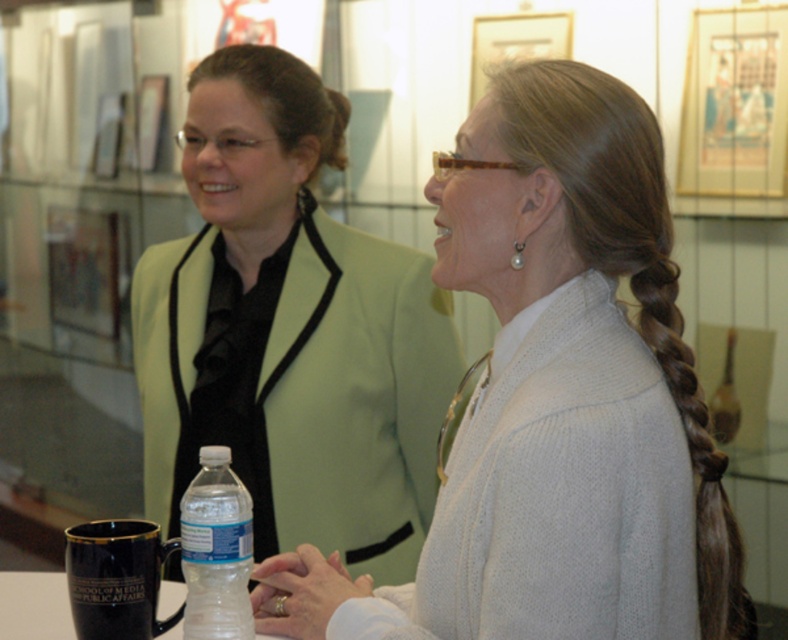
Question: Which of the following is the farthest from the observer?

Choices:
 (A) black ceramic mug at lower left
 (B) transparent plastic bottle at lower center
 (C) matte green blazer at upper left
 (D) clear plastic bottle at lower center

Answer: (C)

Question: Does white knitted sweater at center come in front of matte green blazer at upper left?

Choices:
 (A) yes
 (B) no

Answer: (A)

Question: Can you confirm if black ceramic mug at lower left is smaller than transparent plastic bottle at lower center?

Choices:
 (A) yes
 (B) no

Answer: (A)

Question: Can you confirm if matte green blazer at upper left is thinner than transparent plastic bottle at lower center?

Choices:
 (A) no
 (B) yes

Answer: (A)

Question: Which object is positioned closest to the white knitted sweater at center?

Choices:
 (A) clear plastic bottle at lower center
 (B) black ceramic mug at lower left
 (C) matte green blazer at upper left

Answer: (A)

Question: Which of the following is the closest to the observer?

Choices:
 (A) (552, 150)
 (B) (264, 637)

Answer: (A)